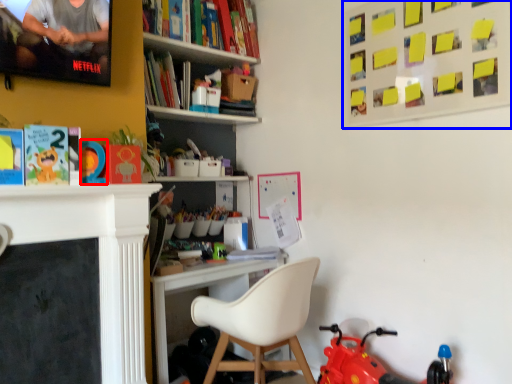
Question: Which of the following is the farthest to the observer, toy (highlighted by a red box) or bulletin board (highlighted by a blue box)?

Choices:
 (A) toy
 (B) bulletin board

Answer: (A)